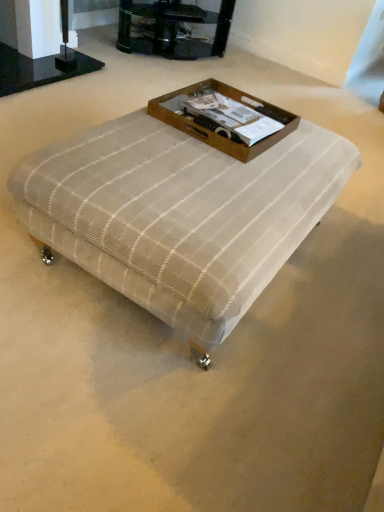
Question: Can you confirm if plaid fabric ottoman at center is smaller than clear glass tv stand at upper center?

Choices:
 (A) yes
 (B) no

Answer: (B)

Question: From the image's perspective, is plaid fabric ottoman at center below clear glass tv stand at upper center?

Choices:
 (A) yes
 (B) no

Answer: (A)

Question: Is the depth of plaid fabric ottoman at center less than that of clear glass tv stand at upper center?

Choices:
 (A) no
 (B) yes

Answer: (B)

Question: From a real-world perspective, is plaid fabric ottoman at center positioned under clear glass tv stand at upper center based on gravity?

Choices:
 (A) no
 (B) yes

Answer: (B)

Question: Is plaid fabric ottoman at center behind clear glass tv stand at upper center?

Choices:
 (A) yes
 (B) no

Answer: (B)

Question: Is clear glass tv stand at upper center in front of or behind plaid fabric ottoman at center in the image?

Choices:
 (A) front
 (B) behind

Answer: (B)

Question: Is clear glass tv stand at upper center inside or outside of plaid fabric ottoman at center?

Choices:
 (A) outside
 (B) inside

Answer: (A)

Question: From the image's perspective, is clear glass tv stand at upper center positioned above or below plaid fabric ottoman at center?

Choices:
 (A) above
 (B) below

Answer: (A)

Question: Is clear glass tv stand at upper center bigger or smaller than plaid fabric ottoman at center?

Choices:
 (A) big
 (B) small

Answer: (B)

Question: From the image's perspective, relative to clear glass tv stand at upper center, is plaid fabric ottoman at center above or below?

Choices:
 (A) above
 (B) below

Answer: (B)

Question: Visually, is plaid fabric ottoman at center positioned to the left or to the right of clear glass tv stand at upper center?

Choices:
 (A) left
 (B) right

Answer: (B)

Question: From a real-world perspective, is plaid fabric ottoman at center above or below clear glass tv stand at upper center?

Choices:
 (A) above
 (B) below

Answer: (B)

Question: In the image, is plaid fabric ottoman at center positioned in front of or behind clear glass tv stand at upper center?

Choices:
 (A) behind
 (B) front

Answer: (B)

Question: In terms of size, does plaid fabric ottoman at center appear bigger or smaller than brown wooden tray at center?

Choices:
 (A) big
 (B) small

Answer: (A)

Question: Is point [x=296, y=159] positioned closer to the camera than point [x=240, y=113]?

Choices:
 (A) farther
 (B) closer

Answer: (B)